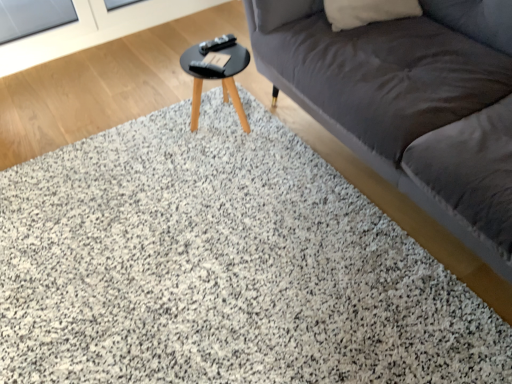
Where is `vacant region under transparent glass screen door at upper left (from a real-world perspective)`? The height and width of the screenshot is (384, 512). vacant region under transparent glass screen door at upper left (from a real-world perspective) is located at coordinates (84, 48).